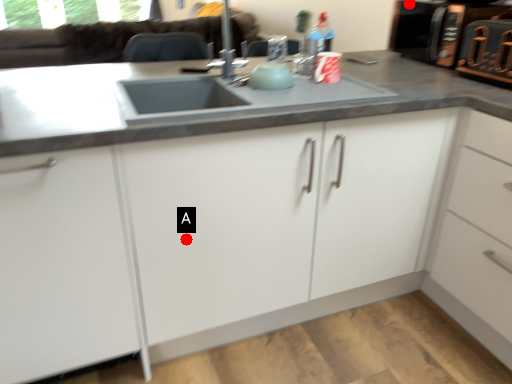
Question: Two points are circled on the image, labeled by A and B beside each circle. Which point appears farthest from the camera in this image?

Choices:
 (A) A is further
 (B) B is further

Answer: (B)